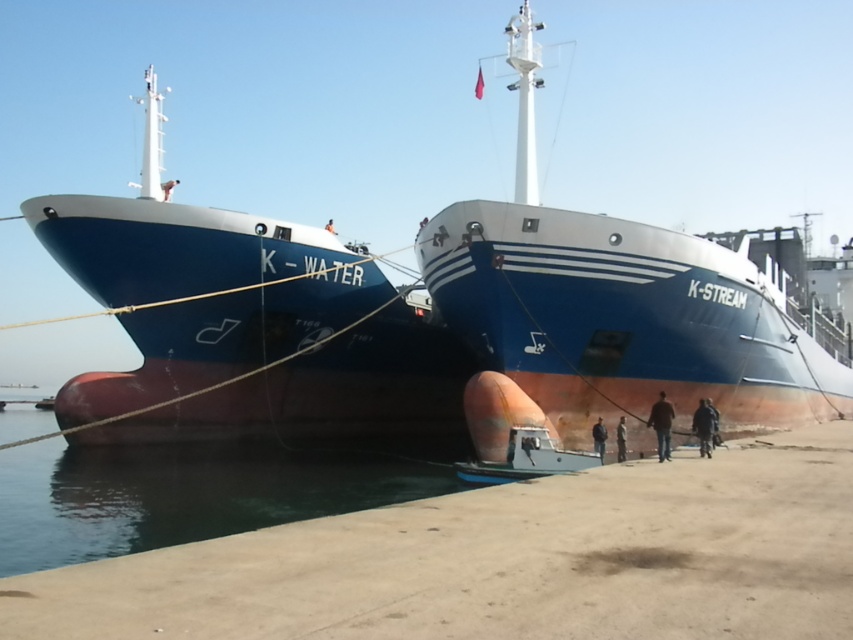
Based on the photo, can you confirm if blue matte ship at left is smaller than rustic metal ship at center?

No.

Does point (453, 337) come farther from viewer compared to point (817, 307)?

No, (453, 337) is closer to viewer.

Which is in front, point (447, 376) or point (461, 282)?

Point (461, 282) is more forward.

You are a GUI agent. You are given a task and a screenshot of the screen. Output one action in this format:
    pyautogui.click(x=<x>, y=<y>)
    Task: Click on the blue matte ship at left
    
    Given the screenshot: What is the action you would take?
    pyautogui.click(x=241, y=323)

Between point (650, 410) and point (703, 422), which one is positioned behind?

Positioned behind is point (650, 410).

Who is more distant from viewer, (651, 413) or (703, 452)?

The point (651, 413) is more distant.

Locate an element on the screen. brown leather jacket at lower center is located at coordinates (660, 424).

Find the location of a particular element. This screenshot has height=640, width=853. rustic metal ship at center is located at coordinates (630, 301).

Does point (515, 58) come farther from viewer compared to point (114, 545)?

That is True.

This screenshot has height=640, width=853. I want to click on rustic metal ship at center, so click(x=630, y=301).